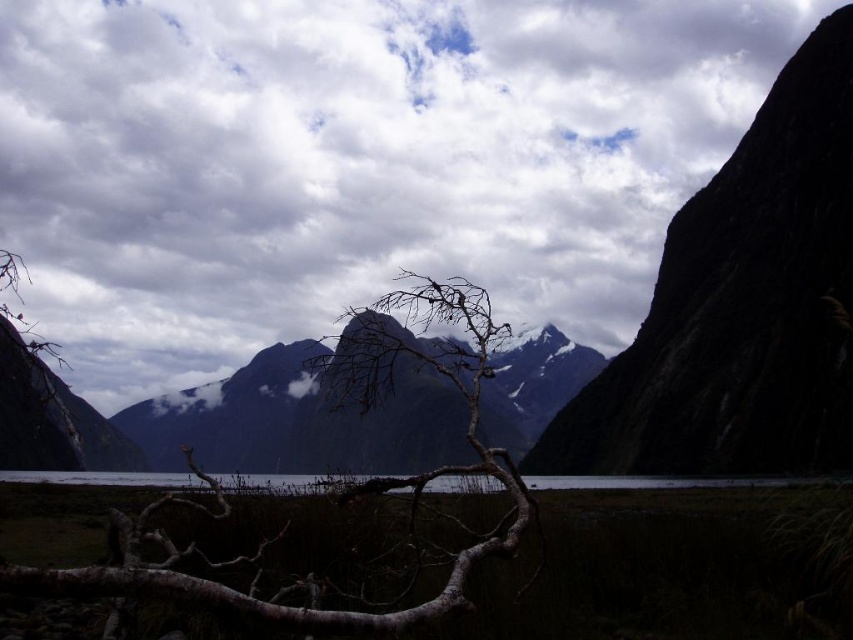
Is point (802, 204) more distant than point (189, 465)?

Yes, point (802, 204) is farther from viewer.

Does black rock mountain at right come behind brown rough tree at center?

Yes, black rock mountain at right is further from the viewer.

Is point (759, 284) positioned in front of point (431, 365)?

That is True.

Identify the location of black rock mountain at right. The width and height of the screenshot is (853, 640). (741, 305).

Can you confirm if brown rough tree at center is bigger than clear water at center?

No.

What are the coordinates of `brown rough tree at center` in the screenshot? It's located at (352, 484).

Which is behind, point (495, 330) or point (86, 481)?

Positioned behind is point (86, 481).

Find the location of a particular element. This screenshot has height=640, width=853. brown rough tree at center is located at coordinates click(352, 484).

Based on the photo, between cloudy sky at upper center and dark gray rocky mountain at center, which one is positioned lower?

dark gray rocky mountain at center is below.

Who is positioned more to the left, cloudy sky at upper center or dark gray rocky mountain at center?

dark gray rocky mountain at center

The width and height of the screenshot is (853, 640). What do you see at coordinates (355, 163) in the screenshot? I see `cloudy sky at upper center` at bounding box center [355, 163].

The image size is (853, 640). I want to click on cloudy sky at upper center, so click(355, 163).